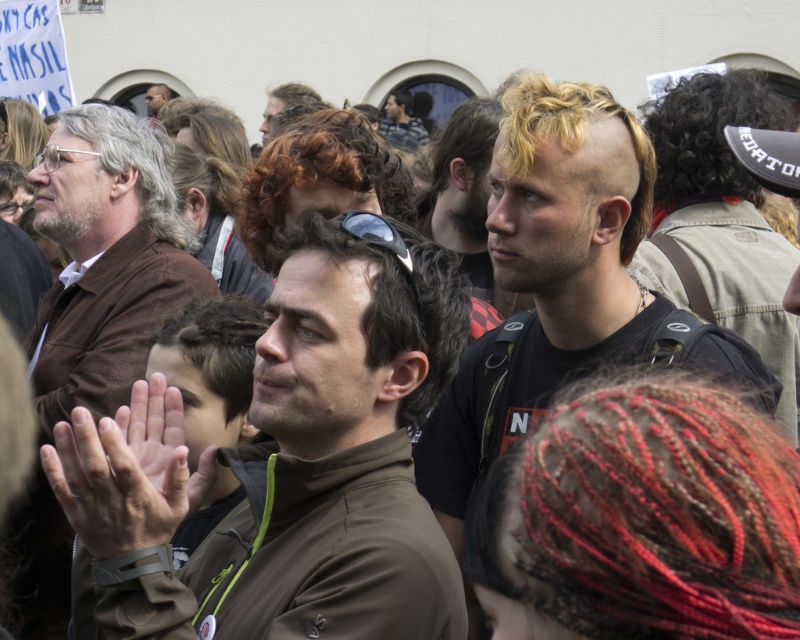
Question: Is brown matte jacket at center bigger than matte black jacket at upper center?

Choices:
 (A) no
 (B) yes

Answer: (B)

Question: Is blonde hair at center smaller than matte black jacket at upper center?

Choices:
 (A) no
 (B) yes

Answer: (A)

Question: Which point appears closest to the camera in this image?

Choices:
 (A) (276, 413)
 (B) (90, 227)

Answer: (A)

Question: Does matte brown jacket at left lie behind matte black jacket at upper center?

Choices:
 (A) no
 (B) yes

Answer: (A)

Question: Considering the real-world distances, which object is farthest from the matte black jacket at upper center?

Choices:
 (A) brown matte jacket at center
 (B) matte brown jacket at left
 (C) blonde hair at center

Answer: (A)

Question: Among these objects, which one is nearest to the camera?

Choices:
 (A) matte brown jacket at left
 (B) blonde hair at center
 (C) brown matte jacket at center

Answer: (C)